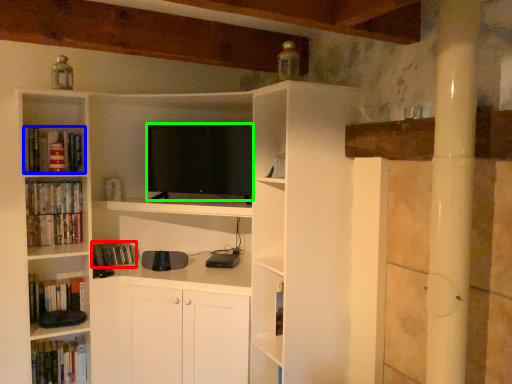
Question: Which object is the closest to the book (highlighted by a red box)? Choose among these: book (highlighted by a blue box) or television (highlighted by a green box).

Choices:
 (A) book
 (B) television

Answer: (A)